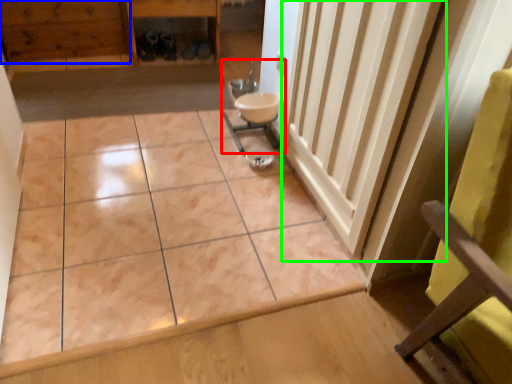
Question: Estimate the real-world distances between objects in this image. Which object is closer to sink (highlighted by a red box), hardwood (highlighted by a blue box) or radiator (highlighted by a green box)?

Choices:
 (A) hardwood
 (B) radiator

Answer: (B)